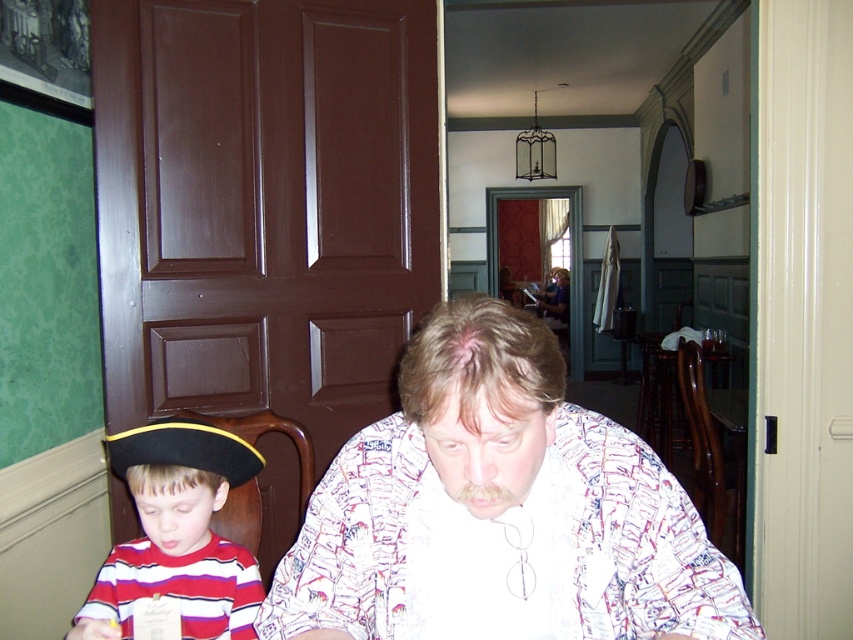
Question: Among these objects, which one is nearest to the camera?

Choices:
 (A) striped cotton shirt at lower left
 (B) white printed shirt at center

Answer: (B)

Question: From the image, what is the correct spatial relationship of white printed shirt at center in relation to striped cotton shirt at lower left?

Choices:
 (A) right
 (B) left

Answer: (A)

Question: Can you confirm if white printed shirt at center is positioned below striped cotton shirt at lower left?

Choices:
 (A) no
 (B) yes

Answer: (A)

Question: Which point is closer to the camera?

Choices:
 (A) striped cotton shirt at lower left
 (B) white printed shirt at center

Answer: (B)

Question: Considering the relative positions of white printed shirt at center and striped cotton shirt at lower left in the image provided, where is white printed shirt at center located with respect to striped cotton shirt at lower left?

Choices:
 (A) below
 (B) above

Answer: (B)